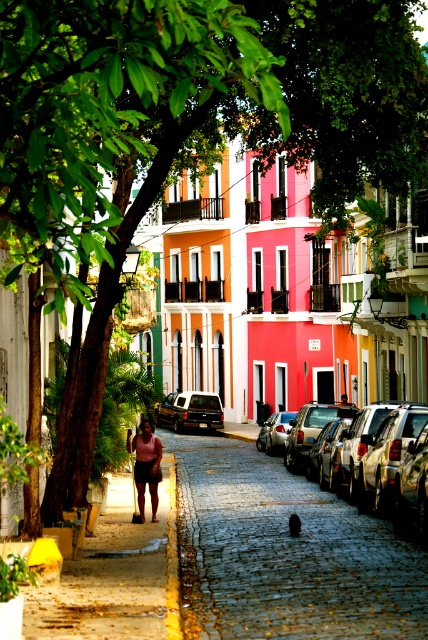
Does point (383, 460) come farther from viewer compared to point (217, 424)?

No, (383, 460) is closer to viewer.

Does shiny silver car at center appear over metallic silver car at center?

Indeed, shiny silver car at center is positioned over metallic silver car at center.

Where is `shiny silver car at center`? The image size is (428, 640). shiny silver car at center is located at coordinates tap(365, 444).

From the picture: Is cobblestone pavement at center smaller than matte pink skin at center?

Actually, cobblestone pavement at center might be larger than matte pink skin at center.

Can you confirm if cobblestone pavement at center is shorter than matte pink skin at center?

Yes, cobblestone pavement at center is shorter than matte pink skin at center.

Does point (376, 518) come behind point (133, 442)?

No, it is not.

This screenshot has height=640, width=428. I want to click on cobblestone pavement at center, so click(285, 554).

Looking at this image, who is more distant from viewer, (x=219, y=492) or (x=213, y=397)?

The point (x=213, y=397) is more distant.

Does cobblestone pavement at center come behind metallic silver car at center?

No, it is not.

What do you see at coordinates (285, 554) in the screenshot? I see `cobblestone pavement at center` at bounding box center [285, 554].

Identify the location of cobblestone pavement at center. This screenshot has height=640, width=428. (285, 554).